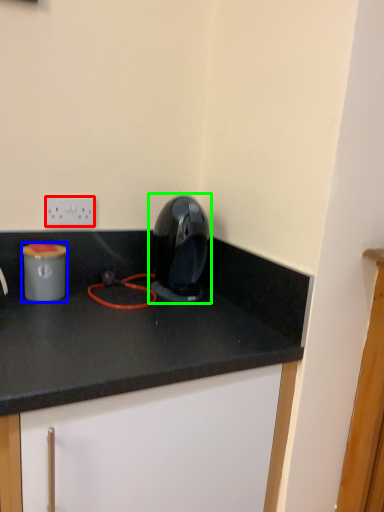
Question: Based on their relative distances, which object is nearer to electric outlet (highlighted by a red box)? Choose from appliance (highlighted by a blue box) and home appliance (highlighted by a green box).

Choices:
 (A) appliance
 (B) home appliance

Answer: (A)